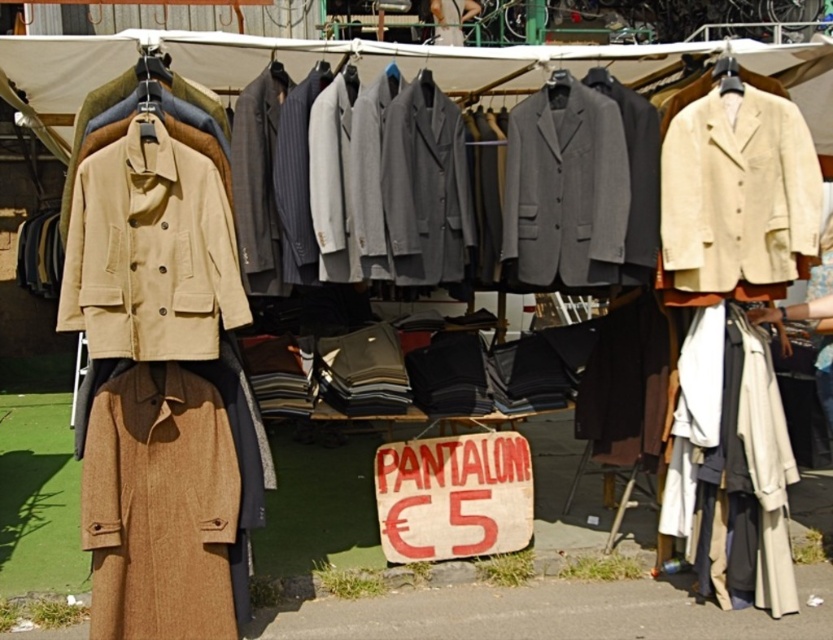
Does point (175, 262) come behind point (671, 218)?

No, it is in front of (671, 218).

What do you see at coordinates (151, 248) in the screenshot? The height and width of the screenshot is (640, 833). I see `beige cotton coat at left` at bounding box center [151, 248].

Locate an element on the screen. This screenshot has height=640, width=833. beige cotton coat at left is located at coordinates (151, 248).

I want to click on beige cotton coat at left, so click(x=151, y=248).

Between point (754, 106) and point (824, 276), which one is positioned in front?

Positioned in front is point (754, 106).

Is point (771, 93) positioned after point (829, 340)?

No.

Between point (781, 99) and point (822, 401), which one is positioned in front?

Point (781, 99) is in front.

The width and height of the screenshot is (833, 640). In order to click on beige corduroy blazer at upper right in this screenshot , I will do `click(737, 193)`.

Is beige cotton coat at left shorter than beige fabric coat at right?

Indeed, beige cotton coat at left has a lesser height compared to beige fabric coat at right.

Is beige cotton coat at left behind beige fabric coat at right?

No, it is not.

Who is more distant from viewer, [72,296] or [831,401]?

The point [831,401] is behind.

Image resolution: width=833 pixels, height=640 pixels. Identify the location of beige cotton coat at left. (151, 248).